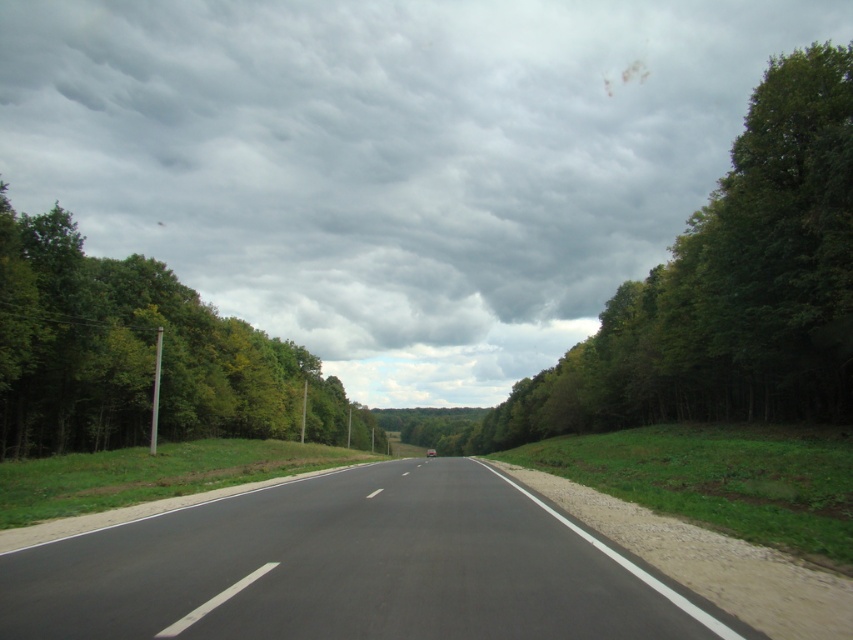
You are a driver approaching the black asphalt highway at center and see the green leafy tree at right. Which one is lower in the image?

The black asphalt highway at center is below green leafy tree at right, so the black asphalt highway at center is lower in the image.

You are driving a car and see the black asphalt highway at center and the green leafy tree at right. Which one is positioned more to the left side of the road?

The black asphalt highway at center is positioned to the left of the green leafy tree at right, so it is more to the left side of the road.